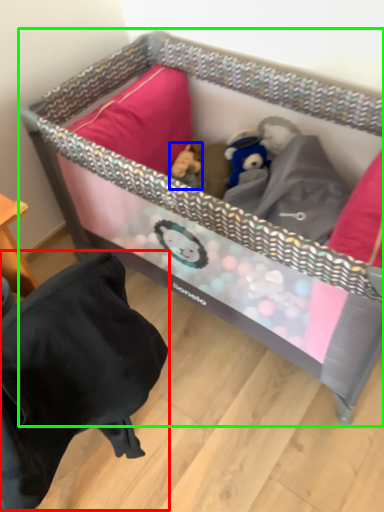
Question: Which object is the closest to the bean bag chair (highlighted by a red box)? Choose among these: toy (highlighted by a blue box) or infant bed (highlighted by a green box).

Choices:
 (A) toy
 (B) infant bed

Answer: (B)